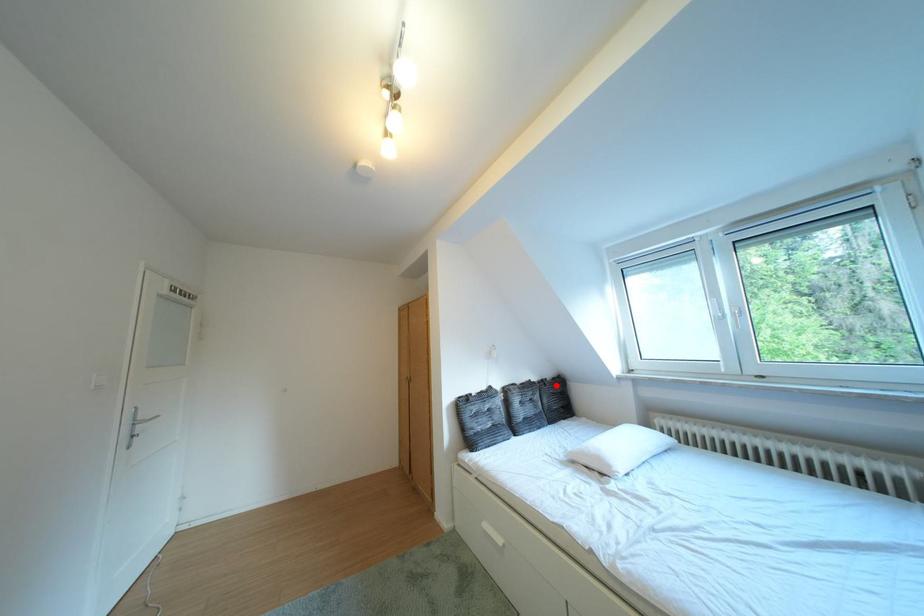
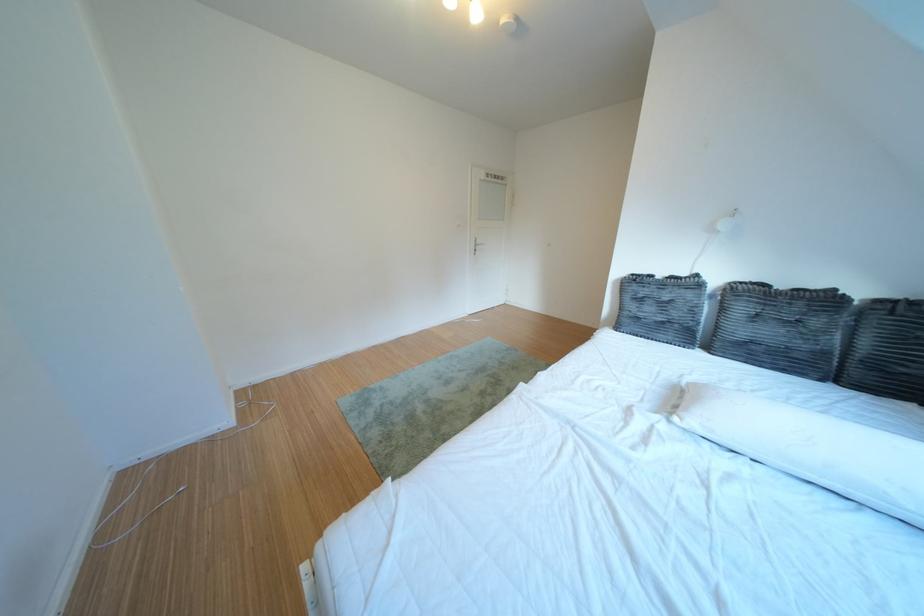
Where in the second image is the point corresponding to the highlighted location from the first image?

(910, 306)